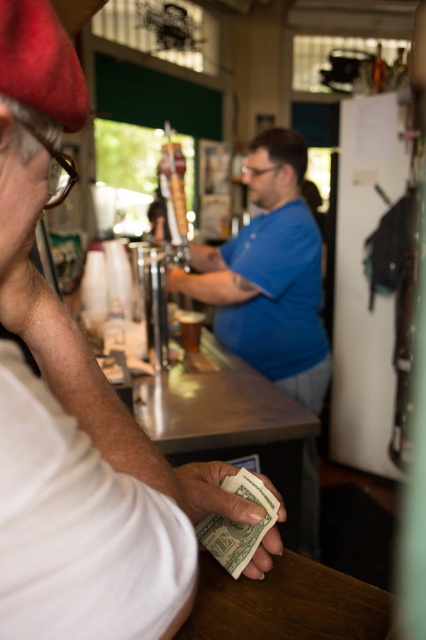
Question: Among these objects, which one is farthest from the camera?

Choices:
 (A) blue cotton shirt at center
 (B) white paper money at lower center

Answer: (A)

Question: Does blue cotton shirt at center have a larger size compared to white paper money at lower center?

Choices:
 (A) no
 (B) yes

Answer: (B)

Question: Is the position of blue cotton shirt at center more distant than that of white paper money at lower center?

Choices:
 (A) yes
 (B) no

Answer: (A)

Question: Which of the following is the farthest from the observer?

Choices:
 (A) (259, 577)
 (B) (313, 445)

Answer: (B)

Question: Is blue cotton shirt at center to the left of white paper money at lower center from the viewer's perspective?

Choices:
 (A) no
 (B) yes

Answer: (A)

Question: Among these points, which one is nearest to the camera?

Choices:
 (A) (216, 481)
 (B) (207, 250)

Answer: (A)